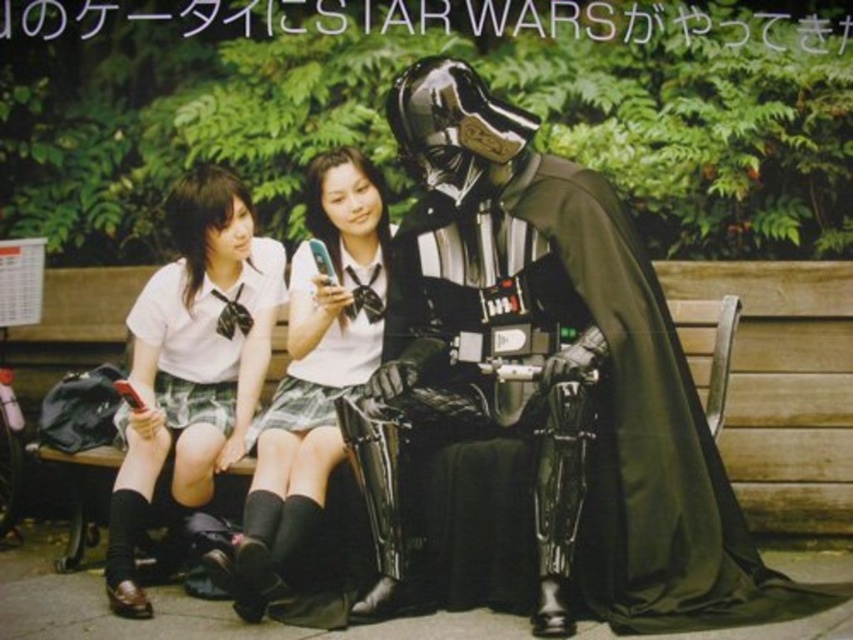
Question: In this image, where is white glossy uniform at center located relative to white fabric skirt at center?

Choices:
 (A) above
 (B) below

Answer: (B)

Question: Is white glossy uniform at center closer to the viewer compared to white fabric skirt at center?

Choices:
 (A) yes
 (B) no

Answer: (B)

Question: In this image, where is white glossy uniform at center located relative to white fabric skirt at center?

Choices:
 (A) left
 (B) right

Answer: (A)

Question: Among these points, which one is farthest from the camera?

Choices:
 (A) (236, 234)
 (B) (375, 314)

Answer: (B)